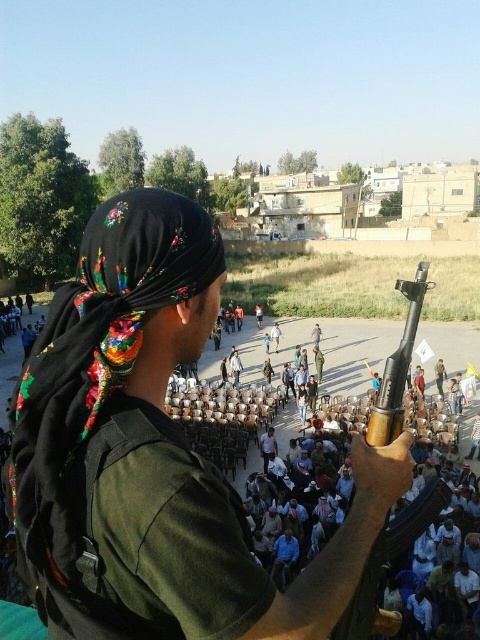
You are a photographer positioned at the top of a stadium. You need to capture a clear shot of the white cotton chairs at center. Which direction should you point your camera to locate them?

The white cotton chairs at center are located at point (207,502), so you should point your camera towards that coordinate to capture them clearly.

You are organizing a small event and need to place a decorative item on the black embroidered headscarf at upper left. The decorative item has the same size as the white cotton chairs at center. Will it fit?

The white cotton chairs at center is bigger than black embroidered headscarf at upper left. Since the decorative item is the same size as the white cotton chairs at center, it will not fit on the black embroidered headscarf at upper left because it is smaller.